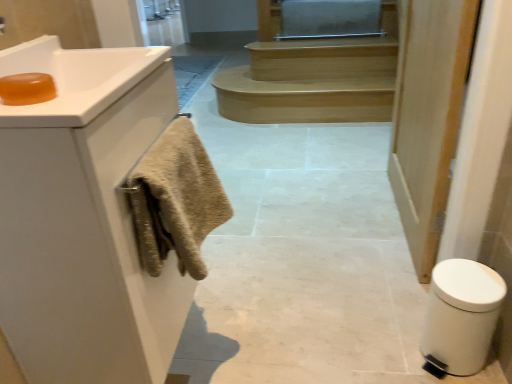
You are a GUI agent. You are given a task and a screenshot of the screen. Output one action in this format:
    pyautogui.click(x=<x>, y=<y>)
    Task: Click on the vacant space situated above white plastic bidet at lower right (from a real-world perspective)
    
    Given the screenshot: What is the action you would take?
    pyautogui.click(x=464, y=282)